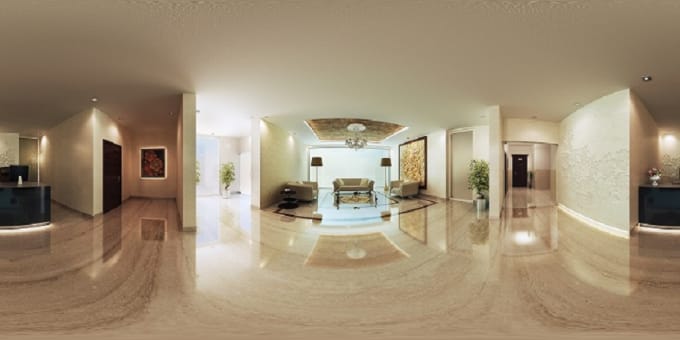
The width and height of the screenshot is (680, 340). I want to click on tray ceiling], so click(333, 130).